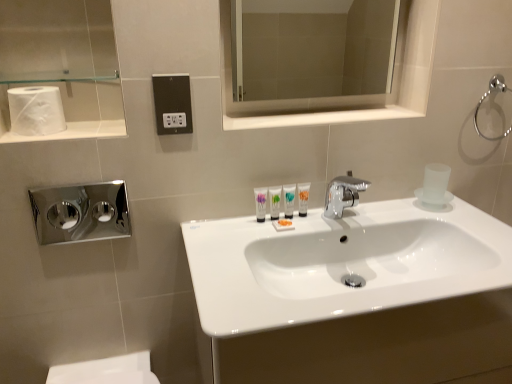
This screenshot has height=384, width=512. What are the coordinates of `vacant space to the right of matte white tube at center, the second mouthwash in the right-to-left sequence` in the screenshot? It's located at (307, 222).